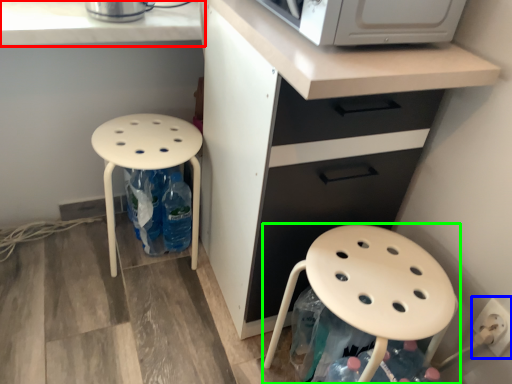
Question: Considering the real-world distances, which object is farthest from countertop (highlighted by a red box)? electric outlet (highlighted by a blue box) or stool (highlighted by a green box)?

Choices:
 (A) electric outlet
 (B) stool

Answer: (A)